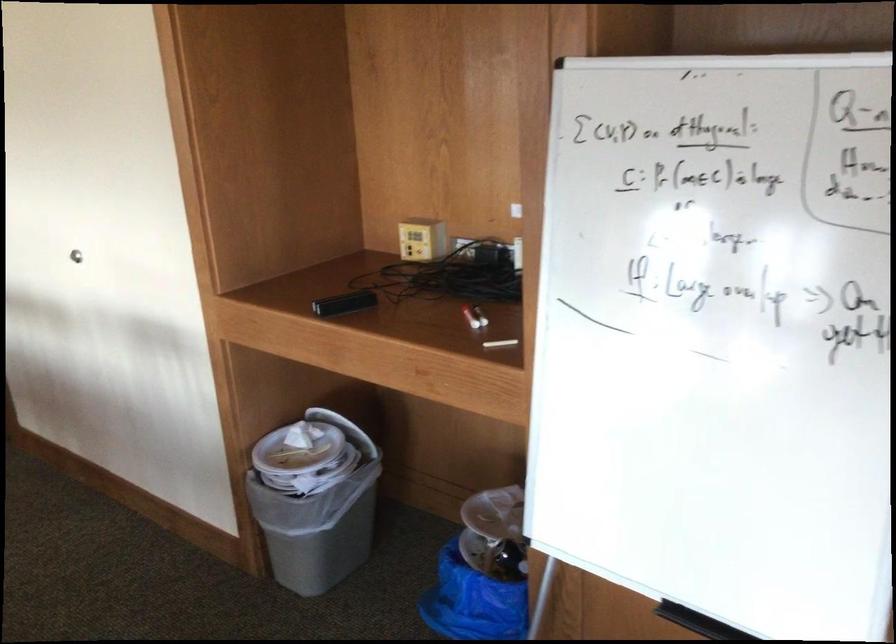
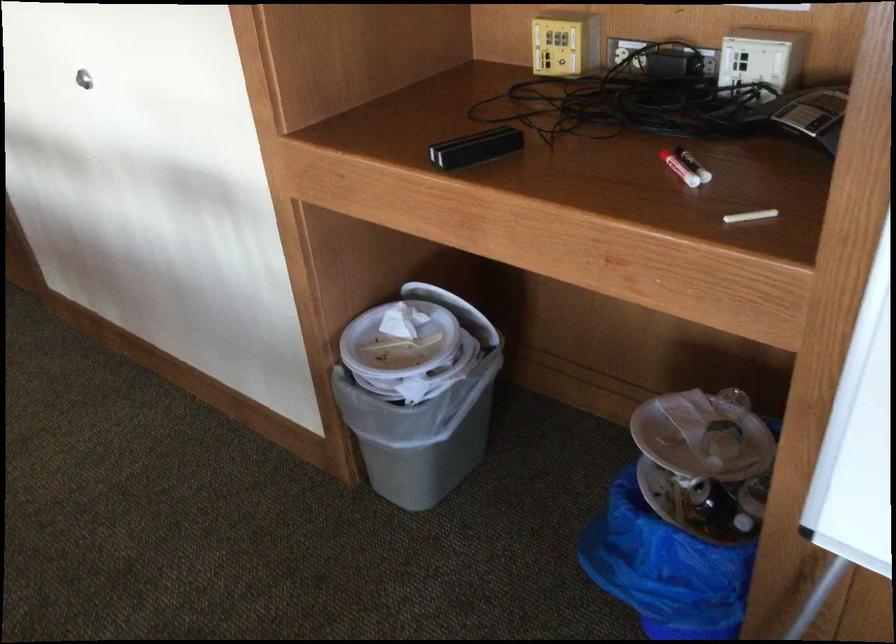
Question: Based on the continuous images, in which direction is the camera rotating? Reply with the corresponding letter.

Choices:
 (A) Left
 (B) Right
 (C) Up
 (D) Down

Answer: (D)